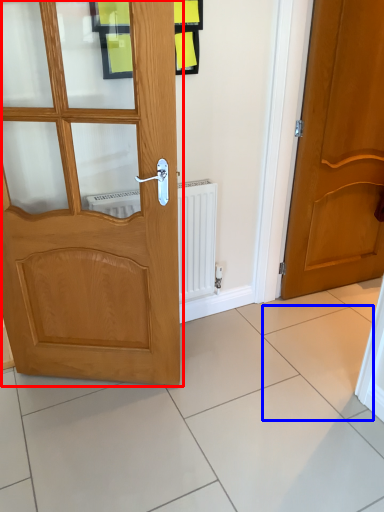
Question: Which of the following is the closest to the observer, door (highlighted by a red box) or ceramic tile (highlighted by a blue box)?

Choices:
 (A) door
 (B) ceramic tile

Answer: (A)